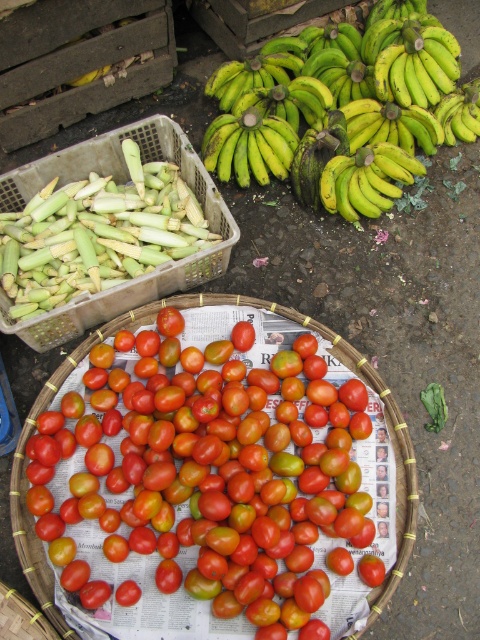
Between point (170, 426) and point (116, 160), which one is positioned in front?

Point (170, 426) is in front.

Is shiny red tomatoes at center to the left of green plastic basket at upper left from the viewer's perspective?

In fact, shiny red tomatoes at center is to the right of green plastic basket at upper left.

Does point (249, 588) come in front of point (169, 124)?

Yes, it is.

Locate an element on the screen. shiny red tomatoes at center is located at coordinates (202, 484).

How far apart are green plastic basket at upper left and green matte bananas at center?

green plastic basket at upper left is 12.65 inches from green matte bananas at center.

Between point (141, 141) and point (287, 161), which one is positioned in front?

Positioned in front is point (141, 141).

This screenshot has height=640, width=480. Find the location of `green plastic basket at upper left`. green plastic basket at upper left is located at coordinates (120, 179).

At what (x,y) coordinates should I click in order to perform the action: click on green plastic basket at upper left. Please return your answer as a coordinate pair (x, y). The image size is (480, 640). Looking at the image, I should click on (120, 179).

Does green matte bananas at upper center appear on the right side of green plastic basket at upper left?

Yes, green matte bananas at upper center is to the right of green plastic basket at upper left.

Is point (315, 68) positioned in front of point (74, 314)?

No, (315, 68) is behind (74, 314).

Image resolution: width=480 pixels, height=640 pixels. Find the location of `green matte bananas at upper center`. green matte bananas at upper center is located at coordinates (335, 108).